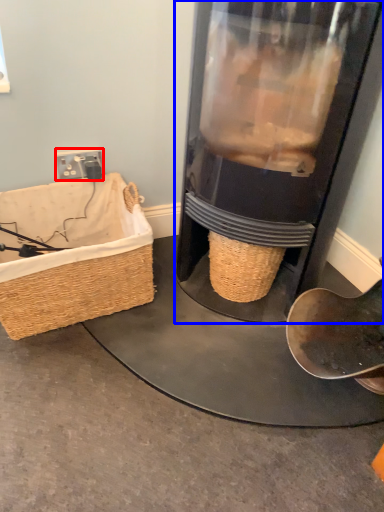
Question: Which object appears closest to the camera in this image, plug (highlighted by a red box) or appliance (highlighted by a blue box)?

Choices:
 (A) plug
 (B) appliance

Answer: (B)